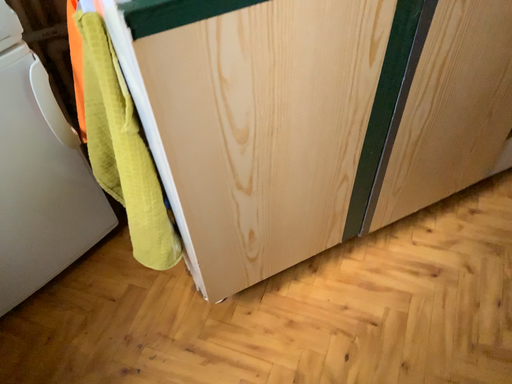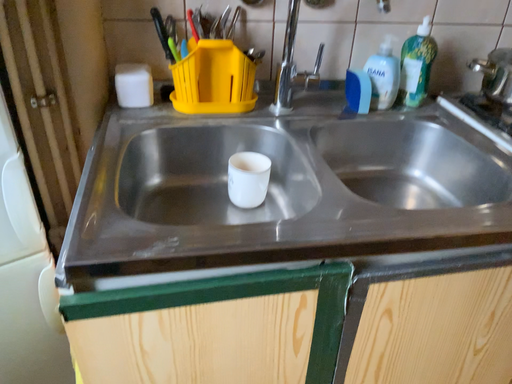
Question: How did the camera likely rotate when shooting the video?

Choices:
 (A) rotated upward
 (B) rotated downward

Answer: (A)